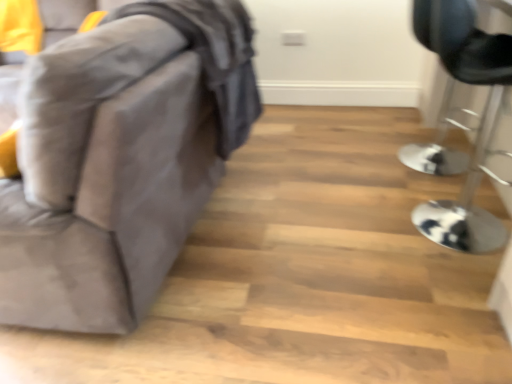
Question: Is velvet gray sofa at left, positioned as the 1th furniture in left-to-right order, positioned beyond the bounds of metallic silver bar stool at right, which is the first furniture in right-to-left order?

Choices:
 (A) yes
 (B) no

Answer: (A)

Question: Is velvet gray sofa at left, positioned as the 1th furniture in left-to-right order, turned away from metallic silver bar stool at right, which is the first furniture in right-to-left order?

Choices:
 (A) no
 (B) yes

Answer: (A)

Question: Considering the relative positions of velvet gray sofa at left, positioned as the 1th furniture in left-to-right order, and metallic silver bar stool at right, which is counted as the second furniture, starting from the left, in the image provided, is velvet gray sofa at left, positioned as the 1th furniture in left-to-right order, to the right of metallic silver bar stool at right, which is counted as the second furniture, starting from the left, from the viewer's perspective?

Choices:
 (A) no
 (B) yes

Answer: (A)

Question: From the image's perspective, is velvet gray sofa at left, positioned as the 1th furniture in left-to-right order, on top of metallic silver bar stool at right, which is counted as the second furniture, starting from the left?

Choices:
 (A) no
 (B) yes

Answer: (B)

Question: Is velvet gray sofa at left, positioned as the 1th furniture in left-to-right order, behind metallic silver bar stool at right, which is the first furniture in right-to-left order?

Choices:
 (A) no
 (B) yes

Answer: (A)

Question: Is velvet gray sofa at left, positioned as the 1th furniture in left-to-right order, positioned before metallic silver bar stool at right, which is the first furniture in right-to-left order?

Choices:
 (A) yes
 (B) no

Answer: (A)

Question: Considering the relative sizes of metallic silver bar stool at right, which is the first furniture in right-to-left order, and velvet gray sofa at left, positioned as the 1th furniture in left-to-right order, in the image provided, is metallic silver bar stool at right, which is the first furniture in right-to-left order, smaller than velvet gray sofa at left, positioned as the 1th furniture in left-to-right order,?

Choices:
 (A) yes
 (B) no

Answer: (A)

Question: Does metallic silver bar stool at right, which is the first furniture in right-to-left order, have a lesser height compared to velvet gray sofa at left, arranged as the 2th furniture when viewed from the right?

Choices:
 (A) yes
 (B) no

Answer: (A)

Question: Is the surface of metallic silver bar stool at right, which is counted as the second furniture, starting from the left, in direct contact with velvet gray sofa at left, arranged as the 2th furniture when viewed from the right?

Choices:
 (A) no
 (B) yes

Answer: (A)

Question: Can velvet gray sofa at left, arranged as the 2th furniture when viewed from the right, be found inside metallic silver bar stool at right, which is counted as the second furniture, starting from the left?

Choices:
 (A) yes
 (B) no

Answer: (B)

Question: Could you tell me if metallic silver bar stool at right, which is counted as the second furniture, starting from the left, is facing velvet gray sofa at left, arranged as the 2th furniture when viewed from the right?

Choices:
 (A) no
 (B) yes

Answer: (A)

Question: Can you confirm if metallic silver bar stool at right, which is counted as the second furniture, starting from the left, is bigger than velvet gray sofa at left, arranged as the 2th furniture when viewed from the right?

Choices:
 (A) no
 (B) yes

Answer: (A)

Question: From the image's perspective, relative to metallic silver bar stool at right, which is counted as the second furniture, starting from the left, is velvet gray sofa at left, positioned as the 1th furniture in left-to-right order, above or below?

Choices:
 (A) above
 (B) below

Answer: (A)